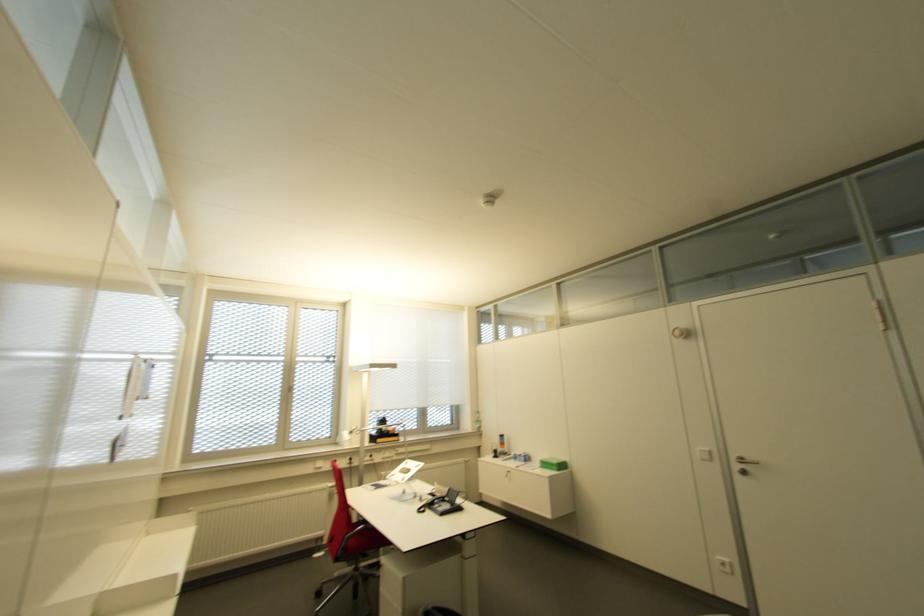
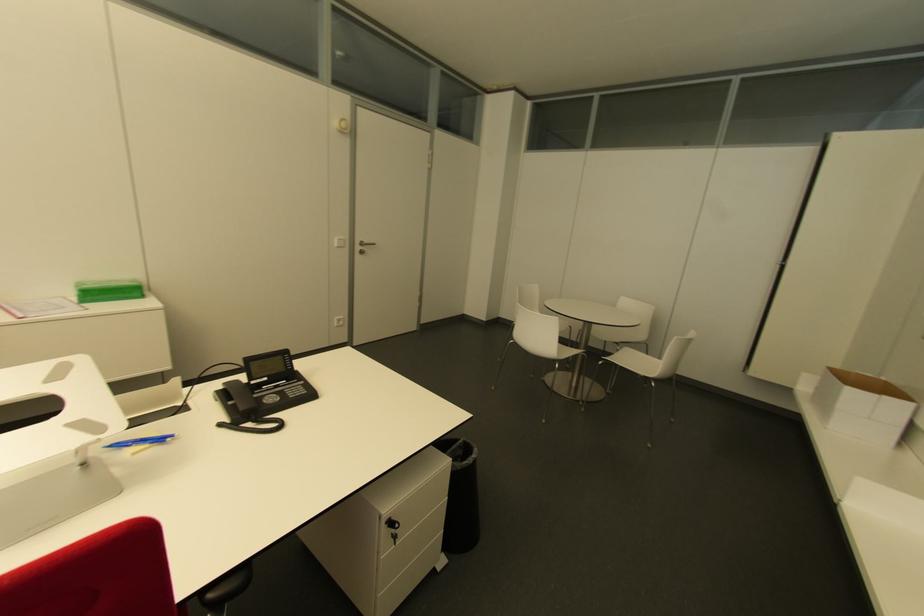
In the second image, find the point that corresponds to (x=542, y=464) in the first image.

(92, 294)